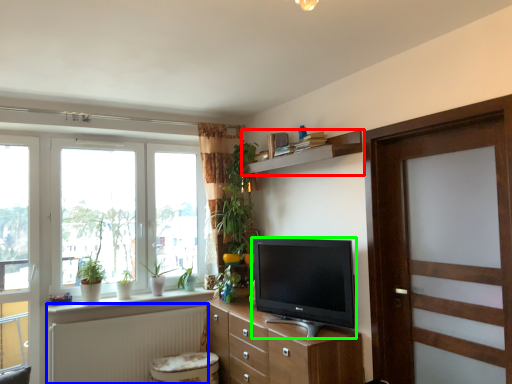
Question: Considering the real-world distances, which object is closest to shelf (highlighted by a red box)? radiator (highlighted by a blue box) or television (highlighted by a green box).

Choices:
 (A) radiator
 (B) television

Answer: (B)